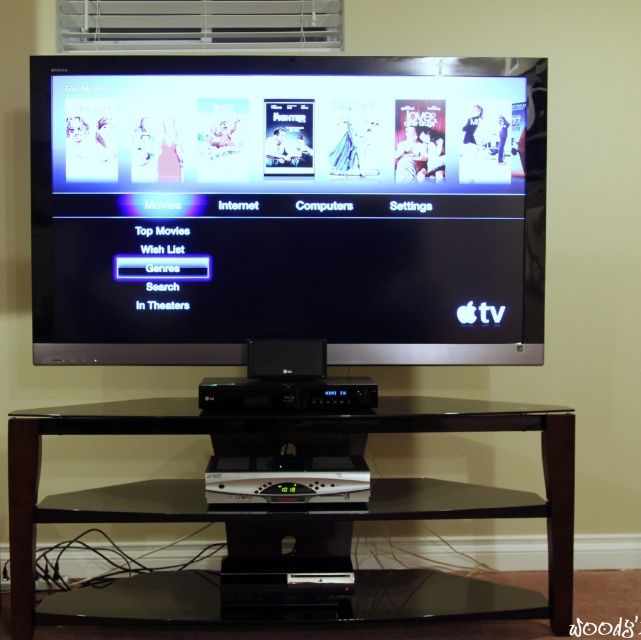
Locate an element on the screen. black glossy screen at upper center is located at coordinates (285, 209).

From the picture: Which of these two, black glossy screen at upper center or black glass table at center, stands taller?

black glossy screen at upper center

Identify the location of black glossy screen at upper center. The height and width of the screenshot is (640, 641). (285, 209).